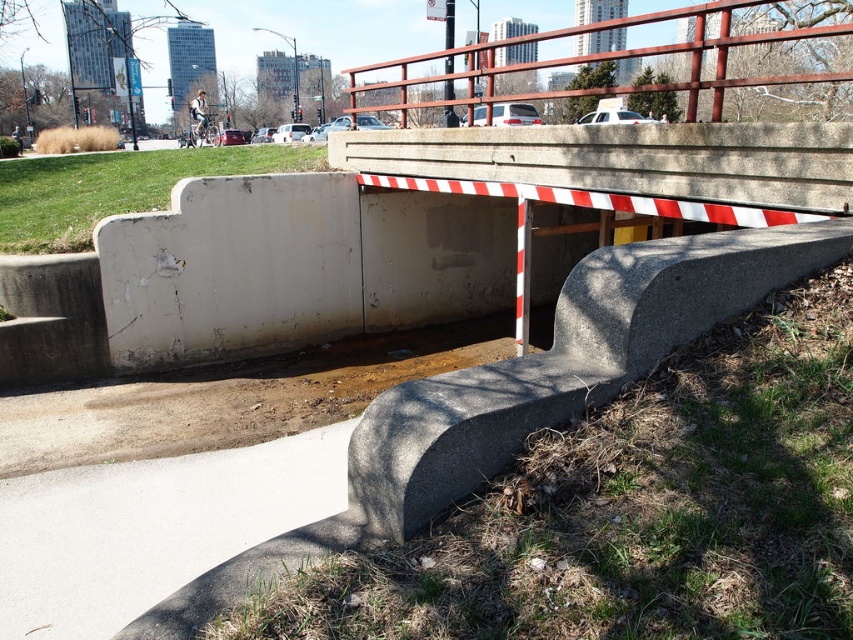
You are standing at the entrance of the underpass and want to reach the point marked at coordinates point (370, 88). Considering the underpass has a red and white striped barrier blocking the entrance, can you walk directly to that point without going around the barrier?

The point marked at coordinates point (370, 88) is 37.49 feet away from the viewer. Since the underpass entrance is blocked by a red and white striped barrier, you cannot walk directly to that point without going around the barrier.

In the scene shown: You are standing at the red and white striped barrier in the underpass. You want to walk to the point marked at coordinates (151, 528). Is that point located on the white concrete pavement at the lower left of the underpass?

Yes, the point at (151, 528) is on the white concrete pavement at lower left, so you can walk there.